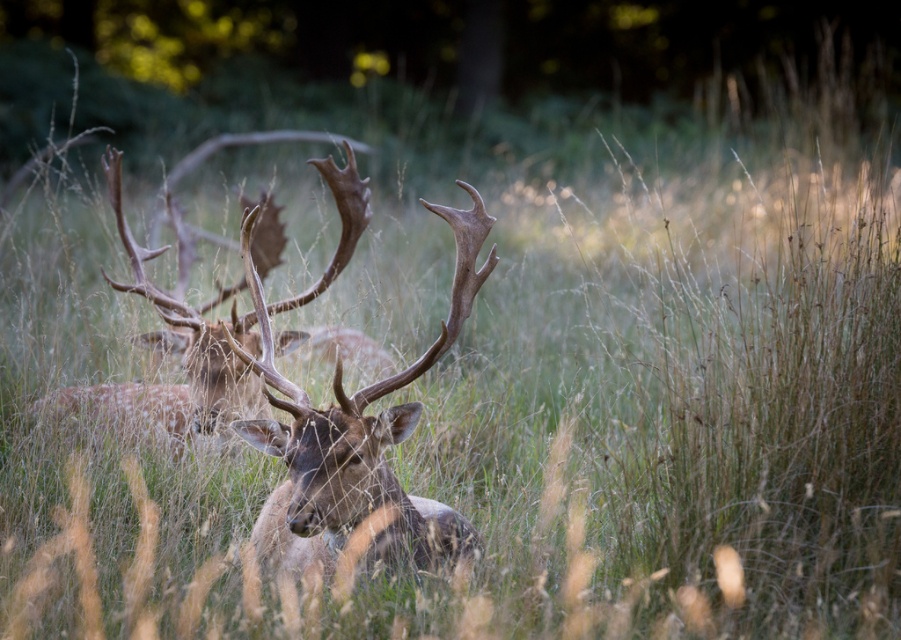
Question: Which of the following is the farthest from the observer?

Choices:
 (A) (272, 552)
 (B) (102, 429)

Answer: (B)

Question: Does brown fur antlers at center have a lesser width compared to brown velvet antlers at center?

Choices:
 (A) no
 (B) yes

Answer: (B)

Question: Can you confirm if brown fur antlers at center is positioned below brown velvet antlers at center?

Choices:
 (A) yes
 (B) no

Answer: (A)

Question: Which point is farther to the camera?

Choices:
 (A) brown fur antlers at center
 (B) brown velvet antlers at center

Answer: (B)

Question: Does brown fur antlers at center appear under brown velvet antlers at center?

Choices:
 (A) no
 (B) yes

Answer: (B)

Question: Among these objects, which one is farthest from the camera?

Choices:
 (A) brown velvet antlers at center
 (B) brown fur antlers at center

Answer: (A)